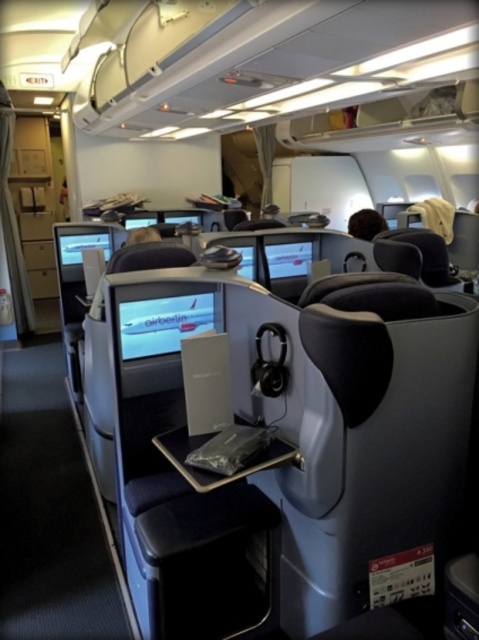
Between white glossy airplane at center and brown fuzzy object at upper center, which one appears on the left side from the viewer's perspective?

white glossy airplane at center is more to the left.

Does white glossy airplane at center appear under brown fuzzy object at upper center?

Indeed, white glossy airplane at center is positioned under brown fuzzy object at upper center.

The image size is (479, 640). Describe the element at coordinates (167, 316) in the screenshot. I see `white glossy airplane at center` at that location.

What are the coordinates of `white glossy airplane at center` in the screenshot? It's located at (167, 316).